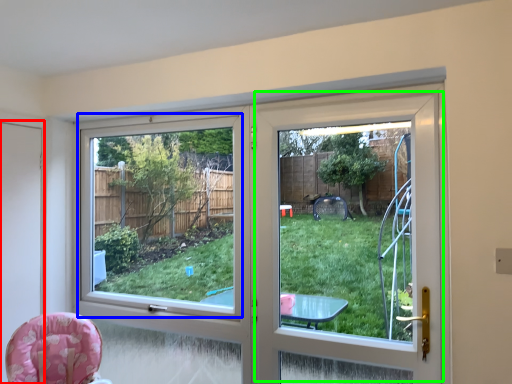
Question: Which object is the closest to the screen door (highlighted by a red box)? Choose among these: window screen (highlighted by a blue box) or screen door (highlighted by a green box).

Choices:
 (A) window screen
 (B) screen door

Answer: (B)